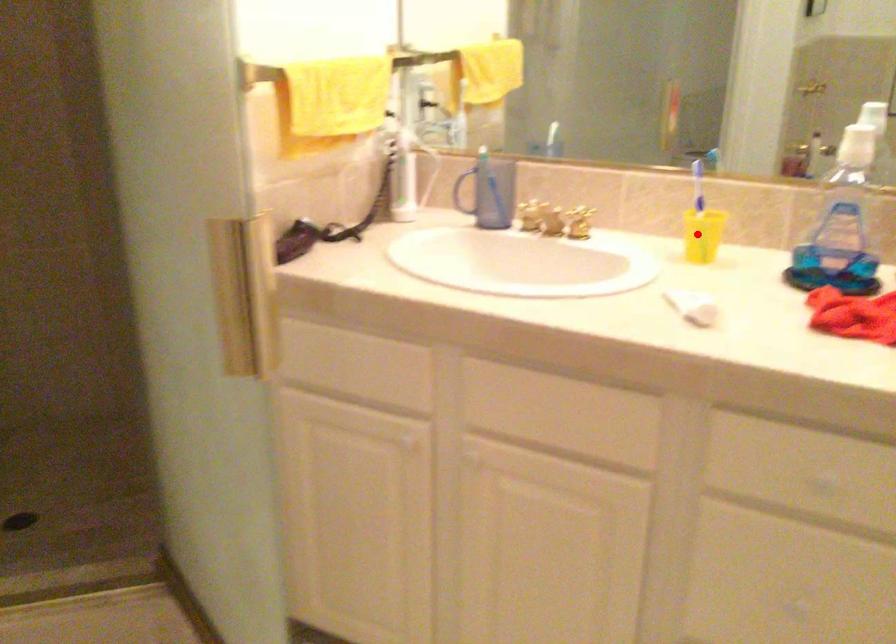
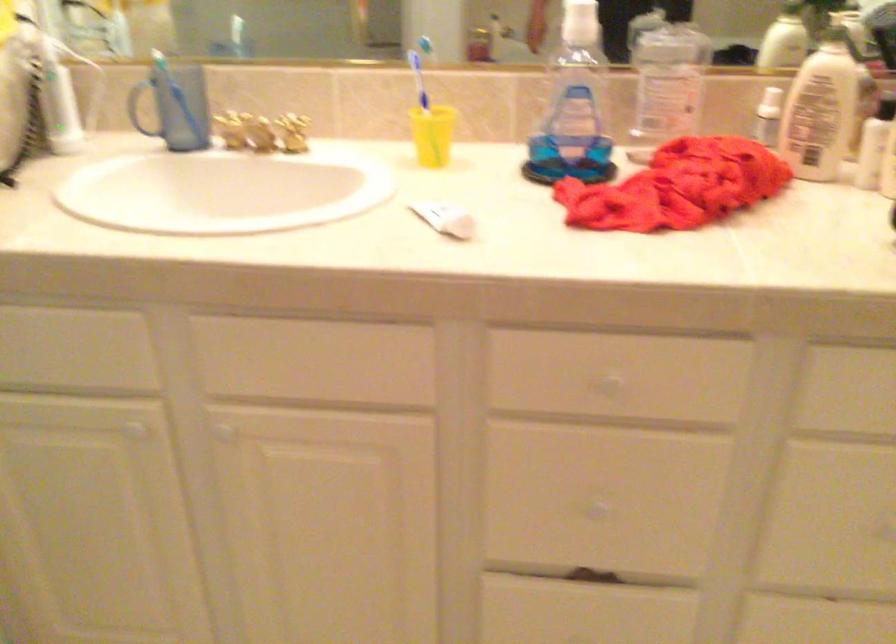
Where in the second image is the point corresponding to the highlighted location from the first image?

(432, 135)